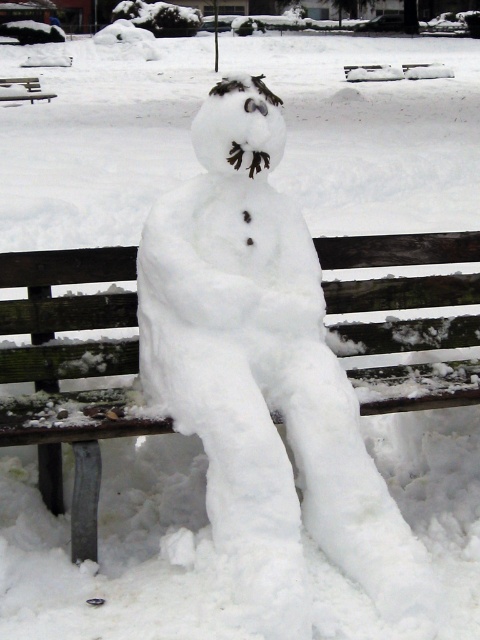
You are a child trying to find a place to sit in the snowy park. You see the wooden bench at center and the brown wooden bench at upper left. Which one is lower to the ground and easier to sit on?

The wooden bench at center is located below the brown wooden bench at upper left, so it is lower to the ground and easier to sit on.

You are a photographer taking a picture of the snowman on the bench. You notice two points marked in the image at coordinates point (340, 401) and point (34, 77). Which point is closer to your camera lens?

Point (340, 401) is closer to the camera lens than point (34, 77).